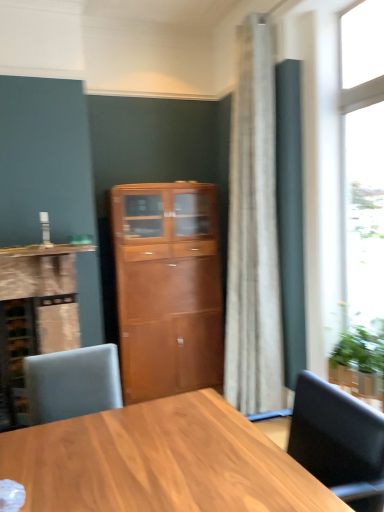
Question: Is matte wood cabinet at left thinner than transparent glass window at right?

Choices:
 (A) no
 (B) yes

Answer: (A)

Question: Is matte wood cabinet at left taller than transparent glass window at right?

Choices:
 (A) no
 (B) yes

Answer: (A)

Question: Is the position of matte wood cabinet at left more distant than that of transparent glass window at right?

Choices:
 (A) yes
 (B) no

Answer: (A)

Question: Can you confirm if matte wood cabinet at left is smaller than transparent glass window at right?

Choices:
 (A) no
 (B) yes

Answer: (A)

Question: Does matte wood cabinet at left have a lesser height compared to transparent glass window at right?

Choices:
 (A) no
 (B) yes

Answer: (B)

Question: Does point coord(377,281) appear closer or farther from the camera than point coord(56,334)?

Choices:
 (A) closer
 (B) farther

Answer: (A)

Question: From their relative heights in the image, would you say transparent glass window at right is taller or shorter than matte wood cabinet at left?

Choices:
 (A) tall
 (B) short

Answer: (A)

Question: In the image, is transparent glass window at right on the left side or the right side of matte wood cabinet at left?

Choices:
 (A) right
 (B) left

Answer: (A)

Question: In the image, is transparent glass window at right positioned in front of or behind matte wood cabinet at left?

Choices:
 (A) behind
 (B) front

Answer: (B)

Question: Is wooden cabinet at center inside the boundaries of matte wood cabinet at left, or outside?

Choices:
 (A) inside
 (B) outside

Answer: (B)

Question: Considering the positions of wooden cabinet at center and matte wood cabinet at left in the image, is wooden cabinet at center bigger or smaller than matte wood cabinet at left?

Choices:
 (A) big
 (B) small

Answer: (A)

Question: From a real-world perspective, relative to matte wood cabinet at left, is wooden cabinet at center vertically above or below?

Choices:
 (A) below
 (B) above

Answer: (B)

Question: Considering their positions, is wooden cabinet at center located in front of or behind matte wood cabinet at left?

Choices:
 (A) front
 (B) behind

Answer: (B)

Question: From a real-world perspective, relative to white marble countertop at left, is matte wood cabinet at left vertically above or below?

Choices:
 (A) above
 (B) below

Answer: (B)

Question: Considering the positions of matte wood cabinet at left and white marble countertop at left in the image, is matte wood cabinet at left bigger or smaller than white marble countertop at left?

Choices:
 (A) big
 (B) small

Answer: (A)